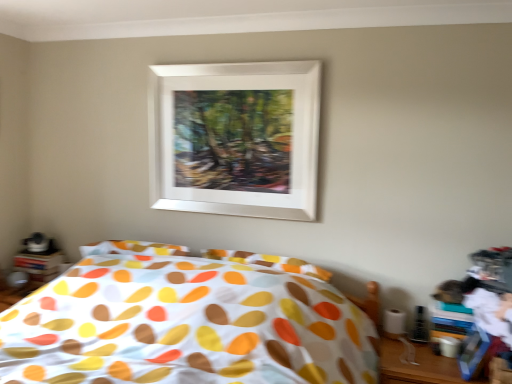
Question: From the image's perspective, is wooden table at lower right beneath white matte picture frame at upper center?

Choices:
 (A) no
 (B) yes

Answer: (B)

Question: Considering the relative sizes of wooden table at lower right and white matte picture frame at upper center in the image provided, is wooden table at lower right thinner than white matte picture frame at upper center?

Choices:
 (A) yes
 (B) no

Answer: (B)

Question: Does wooden table at lower right touch white matte picture frame at upper center?

Choices:
 (A) no
 (B) yes

Answer: (A)

Question: Is wooden table at lower right bigger than white matte picture frame at upper center?

Choices:
 (A) no
 (B) yes

Answer: (B)

Question: Considering the relative positions of wooden table at lower right and white matte picture frame at upper center in the image provided, is wooden table at lower right to the right of white matte picture frame at upper center from the viewer's perspective?

Choices:
 (A) yes
 (B) no

Answer: (A)

Question: Considering the positions of wooden table at lower right and white matte picture frame at upper center in the image, is wooden table at lower right wider or thinner than white matte picture frame at upper center?

Choices:
 (A) wide
 (B) thin

Answer: (A)

Question: From the image's perspective, is wooden table at lower right above or below white matte picture frame at upper center?

Choices:
 (A) below
 (B) above

Answer: (A)

Question: Is wooden table at lower right spatially inside white matte picture frame at upper center, or outside of it?

Choices:
 (A) outside
 (B) inside

Answer: (A)

Question: Visually, is wooden table at lower right positioned to the left or to the right of white matte picture frame at upper center?

Choices:
 (A) right
 (B) left

Answer: (A)

Question: Is white matte picture frame at upper center taller or shorter than wooden table at lower right?

Choices:
 (A) tall
 (B) short

Answer: (A)

Question: In terms of width, does white matte picture frame at upper center look wider or thinner when compared to wooden table at lower right?

Choices:
 (A) thin
 (B) wide

Answer: (A)

Question: Is white matte picture frame at upper center bigger or smaller than wooden table at lower right?

Choices:
 (A) small
 (B) big

Answer: (A)

Question: In the image, is white matte picture frame at upper center on the left side or the right side of wooden table at lower right?

Choices:
 (A) right
 (B) left

Answer: (B)

Question: In terms of size, does white matte picture frame at upper center appear bigger or smaller than polka dot fabric bed at center?

Choices:
 (A) small
 (B) big

Answer: (A)

Question: From the image's perspective, relative to polka dot fabric bed at center, is white matte picture frame at upper center above or below?

Choices:
 (A) below
 (B) above

Answer: (B)